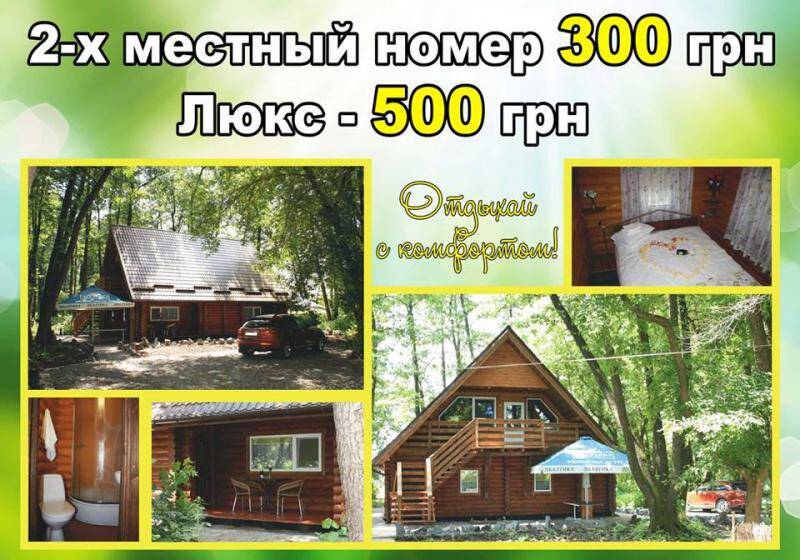
The image size is (800, 560). Identify the location of chair. (294, 493).